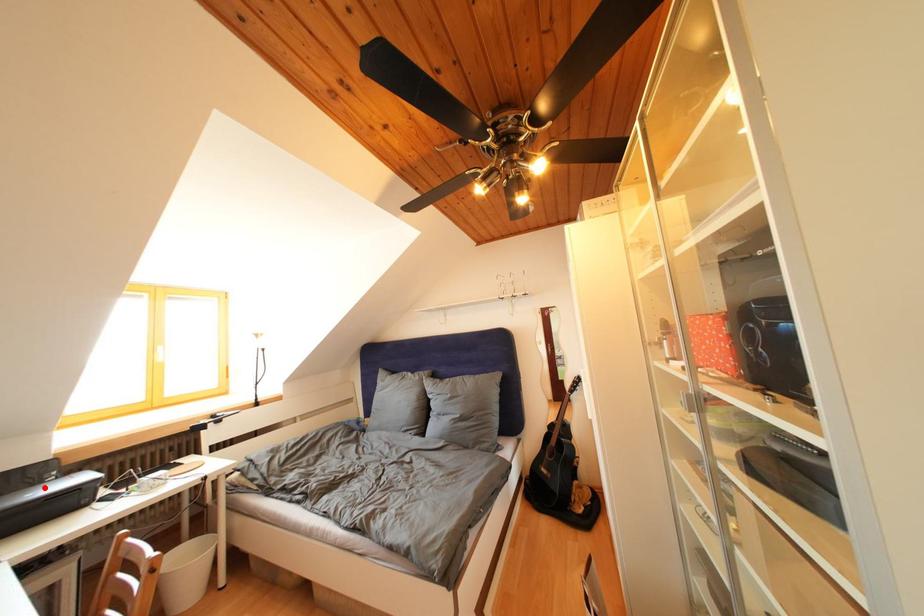
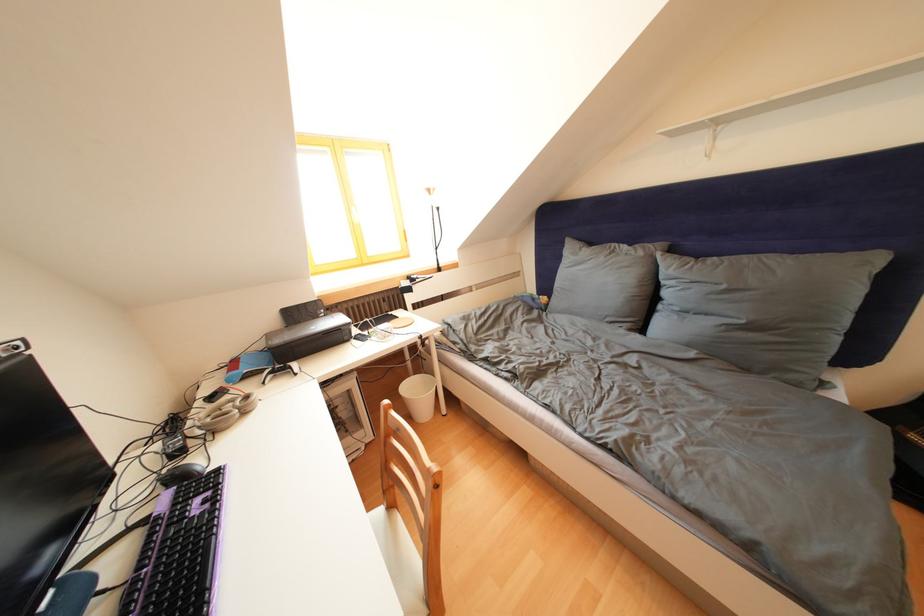
Where in the second image is the point corresponding to the highlighted location from the first image?

(323, 322)